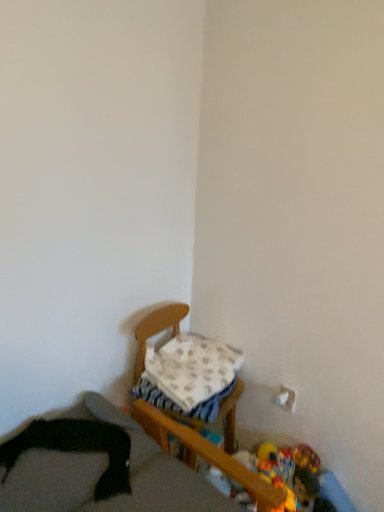
This screenshot has width=384, height=512. What do you see at coordinates (286, 496) in the screenshot?
I see `plush yellow duck at lower right, the 3th toy in the right-to-left sequence` at bounding box center [286, 496].

Locate an element on the screen. This screenshot has width=384, height=512. plush multicolored toy at lower right, which is the 2th toy from left to right is located at coordinates (286, 466).

Identify the location of wooden chair at center, which appears as the first furniture when viewed from the back. (157, 329).

The width and height of the screenshot is (384, 512). Identify the location of black fabric at lower left, positioned as the first furniture in front-to-back order. (103, 471).

Image resolution: width=384 pixels, height=512 pixels. In order to click on plush yellow duck at lower right, the 3th toy in the right-to-left sequence in this screenshot , I will do `click(286, 496)`.

Which object is thinner, white soft blanket at center or plush yellow duck at lower right, the 3th toy in the right-to-left sequence?

plush yellow duck at lower right, the 3th toy in the right-to-left sequence, is thinner.

Is white soft blanket at center facing towards plush yellow duck at lower right, the 3th toy in the right-to-left sequence?

No, white soft blanket at center is not oriented towards plush yellow duck at lower right, the 3th toy in the right-to-left sequence.

In terms of height, does white soft blanket at center look taller or shorter compared to plush yellow duck at lower right, the 3th toy in the right-to-left sequence?

In the image, white soft blanket at center appears to be taller than plush yellow duck at lower right, the 3th toy in the right-to-left sequence.

Is white soft blanket at center in front of or behind plush yellow duck at lower right, which ranks as the first toy in left-to-right order, in the image?

Clearly, white soft blanket at center is behind plush yellow duck at lower right, which ranks as the first toy in left-to-right order.

From a real-world perspective, which object stands above the other?

In real-world perspective, white soft blanket at center is above.

Which of these two, plush multicolored toy at lower right, positioned as the 2th toy in right-to-left order, or white soft blanket at center, is wider?

white soft blanket at center is wider.

Does plush multicolored toy at lower right, positioned as the 2th toy in right-to-left order, have a smaller size compared to white soft blanket at center?

Indeed, plush multicolored toy at lower right, positioned as the 2th toy in right-to-left order, has a smaller size compared to white soft blanket at center.

Considering the positions of objects plush multicolored toy at lower right, positioned as the 2th toy in right-to-left order, and white soft blanket at center in the image provided, who is in front, plush multicolored toy at lower right, positioned as the 2th toy in right-to-left order, or white soft blanket at center?

white soft blanket at center.

Considering the relative positions of wooden chair at center, which appears as the first furniture when viewed from the back, and black fabric at lower left, positioned as the first furniture in front-to-back order, in the image provided, is wooden chair at center, which appears as the first furniture when viewed from the back, behind black fabric at lower left, positioned as the first furniture in front-to-back order,?

Yes, wooden chair at center, which appears as the first furniture when viewed from the back, is further from the viewer.

Considering the points (142, 328) and (162, 457), which point is in front, point (142, 328) or point (162, 457)?

Positioned in front is point (162, 457).

From a real-world perspective, which is physically above, wooden chair at center, which appears as the first furniture when viewed from the back, or black fabric at lower left, acting as the 2th furniture starting from the back?

In real-world perspective, black fabric at lower left, acting as the 2th furniture starting from the back, is above.

Does plush yellow duck at lower right, the third toy when ordered from left to right, have a greater height compared to white soft blanket at center?

No, plush yellow duck at lower right, the third toy when ordered from left to right, is not taller than white soft blanket at center.

Can white soft blanket at center be found inside plush yellow duck at lower right, which is counted as the first toy, starting from the right?

No, white soft blanket at center is not surrounded by plush yellow duck at lower right, which is counted as the first toy, starting from the right.

This screenshot has height=512, width=384. I want to click on pillow above the plush yellow duck at lower right, which is counted as the first toy, starting from the right (from the image's perspective), so click(x=191, y=374).

Does point (310, 492) appear closer or farther from the camera than point (165, 346)?

Point (310, 492) is closer to the camera than point (165, 346).

Is plush multicolored toy at lower right, positioned as the 2th toy in right-to-left order, touching plush yellow duck at lower right, the third toy when ordered from left to right?

Absolutely, plush multicolored toy at lower right, positioned as the 2th toy in right-to-left order, is next to and touching plush yellow duck at lower right, the third toy when ordered from left to right.

Does plush multicolored toy at lower right, which is the 2th toy from left to right, turn towards plush yellow duck at lower right, the third toy when ordered from left to right?

Yes, plush multicolored toy at lower right, which is the 2th toy from left to right, is oriented towards plush yellow duck at lower right, the third toy when ordered from left to right.

From the picture: Is the position of plush multicolored toy at lower right, positioned as the 2th toy in right-to-left order, more distant than that of plush yellow duck at lower right, which is counted as the first toy, starting from the right?

Yes, the depth of plush multicolored toy at lower right, positioned as the 2th toy in right-to-left order, is greater than that of plush yellow duck at lower right, which is counted as the first toy, starting from the right.

Is white soft blanket at center at the back of black fabric at lower left, acting as the 2th furniture starting from the back?

No, black fabric at lower left, acting as the 2th furniture starting from the back, is not facing away from white soft blanket at center.

Is point (200, 501) more distant than point (168, 366)?

No, (200, 501) is closer to viewer.

Is black fabric at lower left, positioned as the first furniture in front-to-back order, spatially inside white soft blanket at center, or outside of it?

black fabric at lower left, positioned as the first furniture in front-to-back order, exists outside the volume of white soft blanket at center.

The image size is (384, 512). Find the location of `the 1st furniture positioned below the white soft blanket at center (from a real-world perspective)`. the 1st furniture positioned below the white soft blanket at center (from a real-world perspective) is located at coordinates (103, 471).

In the scene shown: From a real-world perspective, is black fabric at lower left, positioned as the first furniture in front-to-back order, below plush yellow duck at lower right, which ranks as the first toy in left-to-right order?

No, from a real-world perspective, black fabric at lower left, positioned as the first furniture in front-to-back order, is not below plush yellow duck at lower right, which ranks as the first toy in left-to-right order.

Can you confirm if black fabric at lower left, positioned as the first furniture in front-to-back order, is positioned to the right of plush yellow duck at lower right, the 3th toy in the right-to-left sequence?

In fact, black fabric at lower left, positioned as the first furniture in front-to-back order, is to the left of plush yellow duck at lower right, the 3th toy in the right-to-left sequence.

In the scene shown: Considering the relative sizes of black fabric at lower left, positioned as the first furniture in front-to-back order, and plush yellow duck at lower right, the 3th toy in the right-to-left sequence, in the image provided, is black fabric at lower left, positioned as the first furniture in front-to-back order, taller than plush yellow duck at lower right, the 3th toy in the right-to-left sequence,?

No, black fabric at lower left, positioned as the first furniture in front-to-back order, is not taller than plush yellow duck at lower right, the 3th toy in the right-to-left sequence.

In terms of size, does black fabric at lower left, acting as the 2th furniture starting from the back, appear bigger or smaller than plush yellow duck at lower right, which ranks as the first toy in left-to-right order?

Considering their sizes, black fabric at lower left, acting as the 2th furniture starting from the back, takes up more space than plush yellow duck at lower right, which ranks as the first toy in left-to-right order.

Starting from the white soft blanket at center, which toy is the 2nd one in front? Please provide its 2D coordinates.

[(286, 496)]

From the image's perspective, which toy is the 1st one below the white soft blanket at center? Please provide its 2D coordinates.

[(286, 466)]

Looking at the image, which one is located closer to white soft blanket at center, plush yellow duck at lower right, which ranks as the first toy in left-to-right order, or wooden chair at center, which appears as the first furniture when viewed from the back?

The object closer to white soft blanket at center is wooden chair at center, which appears as the first furniture when viewed from the back.

Based on their spatial positions, is wooden chair at center, the second furniture viewed from the front, or plush yellow duck at lower right, the 3th toy in the right-to-left sequence, closer to plush multicolored toy at lower right, positioned as the 2th toy in right-to-left order?

The object closer to plush multicolored toy at lower right, positioned as the 2th toy in right-to-left order, is plush yellow duck at lower right, the 3th toy in the right-to-left sequence.

Based on their spatial positions, is plush yellow duck at lower right, the third toy when ordered from left to right, or plush multicolored toy at lower right, positioned as the 2th toy in right-to-left order, closer to black fabric at lower left, positioned as the first furniture in front-to-back order?

Based on the image, plush multicolored toy at lower right, positioned as the 2th toy in right-to-left order, appears to be nearer to black fabric at lower left, positioned as the first furniture in front-to-back order.

Which object lies nearer to the anchor point white soft blanket at center, plush yellow duck at lower right, the third toy when ordered from left to right, or plush multicolored toy at lower right, which is the 2th toy from left to right?

plush multicolored toy at lower right, which is the 2th toy from left to right.

When comparing their distances from plush yellow duck at lower right, which is counted as the first toy, starting from the right, does plush multicolored toy at lower right, which is the 2th toy from left to right, or wooden chair at center, which appears as the first furniture when viewed from the back, seem closer?

Among the two, plush multicolored toy at lower right, which is the 2th toy from left to right, is located nearer to plush yellow duck at lower right, which is counted as the first toy, starting from the right.

Based on their spatial positions, is plush yellow duck at lower right, the 3th toy in the right-to-left sequence, or black fabric at lower left, positioned as the first furniture in front-to-back order, closer to white soft blanket at center?

Among the two, black fabric at lower left, positioned as the first furniture in front-to-back order, is located nearer to white soft blanket at center.

Based on their spatial positions, is wooden chair at center, the second furniture viewed from the front, or black fabric at lower left, positioned as the first furniture in front-to-back order, closer to plush yellow duck at lower right, which ranks as the first toy in left-to-right order?

Based on the image, wooden chair at center, the second furniture viewed from the front, appears to be nearer to plush yellow duck at lower right, which ranks as the first toy in left-to-right order.

From the image, which object appears to be farther from wooden chair at center, the second furniture viewed from the front, plush yellow duck at lower right, which ranks as the first toy in left-to-right order, or white soft blanket at center?

plush yellow duck at lower right, which ranks as the first toy in left-to-right order, is further to wooden chair at center, the second furniture viewed from the front.

The height and width of the screenshot is (512, 384). I want to click on furniture situated between white soft blanket at center and plush yellow duck at lower right, which is counted as the first toy, starting from the right, from left to right, so click(x=157, y=329).

Identify the location of furniture located between black fabric at lower left, acting as the 2th furniture starting from the back, and plush yellow duck at lower right, the 3th toy in the right-to-left sequence, in the left-right direction. Image resolution: width=384 pixels, height=512 pixels. (157, 329).

Where is `toy positioned between plush yellow duck at lower right, which ranks as the first toy in left-to-right order, and plush multicolored toy at lower right, which is the 2th toy from left to right, from near to far`? The image size is (384, 512). toy positioned between plush yellow duck at lower right, which ranks as the first toy in left-to-right order, and plush multicolored toy at lower right, which is the 2th toy from left to right, from near to far is located at coordinates (305, 488).

Identify the location of furniture between black fabric at lower left, positioned as the first furniture in front-to-back order, and plush multicolored toy at lower right, positioned as the 2th toy in right-to-left order, in the horizontal direction. The image size is (384, 512). (157, 329).